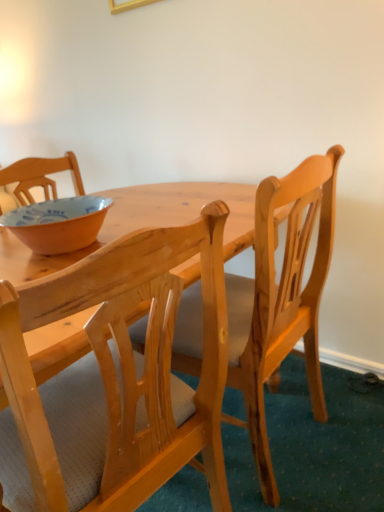
Where is `natural wood chair at center, marked as the first chair in a right-to-left arrangement`? Image resolution: width=384 pixels, height=512 pixels. natural wood chair at center, marked as the first chair in a right-to-left arrangement is located at coordinates (281, 298).

Locate an element on the screen. The image size is (384, 512). matte orange bowl at left is located at coordinates point(58,223).

Where is `natural wood chair at center, the second chair from the left`? Image resolution: width=384 pixels, height=512 pixels. natural wood chair at center, the second chair from the left is located at coordinates (281, 298).

Is natural wood chair at center, which is the second chair in right-to-left order, completely or partially outside of natural wood chair at center, the second chair from the left?

That's correct, natural wood chair at center, which is the second chair in right-to-left order, is outside of natural wood chair at center, the second chair from the left.

Which object is closer to the camera taking this photo, natural wood chair at center, which is the second chair in right-to-left order, or natural wood chair at center, marked as the first chair in a right-to-left arrangement?

natural wood chair at center, which is the second chair in right-to-left order, is closer to the camera.

From the image's perspective, which object appears higher, natural wood chair at center, the 1th chair in the left-to-right sequence, or natural wood chair at center, marked as the first chair in a right-to-left arrangement?

natural wood chair at center, marked as the first chair in a right-to-left arrangement, appears higher in the image.

In order to click on chair that is behind the natural wood chair at center, the 1th chair in the left-to-right sequence in this screenshot , I will do `click(281, 298)`.

Is natural wood chair at center, the second chair from the left, looking in the opposite direction of natural wood chair at center, which is the second chair in right-to-left order?

No, natural wood chair at center, the second chair from the left,'s orientation is not away from natural wood chair at center, which is the second chair in right-to-left order.

From a real-world perspective, is natural wood chair at center, the second chair from the left, above or below natural wood chair at center, the 1th chair in the left-to-right sequence?

From a real-world perspective, natural wood chair at center, the second chair from the left, is physically above natural wood chair at center, the 1th chair in the left-to-right sequence.

Is the surface of natural wood chair at center, the second chair from the left, in direct contact with natural wood chair at center, which is the second chair in right-to-left order?

No, natural wood chair at center, the second chair from the left, is not in contact with natural wood chair at center, which is the second chair in right-to-left order.

Who is shorter, natural wood chair at center, the second chair from the left, or natural wood chair at center, which is the second chair in right-to-left order?

natural wood chair at center, which is the second chair in right-to-left order, is shorter.

Considering the sizes of objects matte orange bowl at left and natural wood chair at center, the 1th chair in the left-to-right sequence, in the image provided, who is shorter, matte orange bowl at left or natural wood chair at center, the 1th chair in the left-to-right sequence,?

matte orange bowl at left is shorter.

Is natural wood chair at center, which is the second chair in right-to-left order, completely or partially inside matte orange bowl at left?

No, matte orange bowl at left does not contain natural wood chair at center, which is the second chair in right-to-left order.

Which object is closer to the camera taking this photo, matte orange bowl at left or natural wood chair at center, marked as the first chair in a right-to-left arrangement?

natural wood chair at center, marked as the first chair in a right-to-left arrangement, is in front.

How many degrees apart are the facing directions of matte orange bowl at left and natural wood chair at center, the second chair from the left?

The angular difference between matte orange bowl at left and natural wood chair at center, the second chair from the left, is 88.2 degrees.

Is matte orange bowl at left not inside natural wood chair at center, marked as the first chair in a right-to-left arrangement?

matte orange bowl at left is positioned outside natural wood chair at center, marked as the first chair in a right-to-left arrangement.

How many degrees apart are the facing directions of natural wood chair at center, the 1th chair in the left-to-right sequence, and matte orange bowl at left?

The angular difference between natural wood chair at center, the 1th chair in the left-to-right sequence, and matte orange bowl at left is 88.2 degrees.

From a real-world perspective, is natural wood chair at center, which is the second chair in right-to-left order, above or below matte orange bowl at left?

natural wood chair at center, which is the second chair in right-to-left order, is situated lower than matte orange bowl at left in the real world.

Who is smaller, natural wood chair at center, which is the second chair in right-to-left order, or matte orange bowl at left?

matte orange bowl at left is smaller.

From the image's perspective, is natural wood chair at center, which is the second chair in right-to-left order, above matte orange bowl at left?

Actually, natural wood chair at center, which is the second chair in right-to-left order, appears below matte orange bowl at left in the image.

Which object is further away from the camera, natural wood chair at center, the second chair from the left, or matte orange bowl at left?

matte orange bowl at left is behind.

Does natural wood chair at center, the second chair from the left, appear on the left side of matte orange bowl at left?

No.

Considering the sizes of objects natural wood chair at center, marked as the first chair in a right-to-left arrangement, and matte orange bowl at left in the image provided, who is wider, natural wood chair at center, marked as the first chair in a right-to-left arrangement, or matte orange bowl at left?

With larger width is natural wood chair at center, marked as the first chair in a right-to-left arrangement.

Is natural wood chair at center, the second chair from the left, aimed at matte orange bowl at left?

No, natural wood chair at center, the second chair from the left, is not turned towards matte orange bowl at left.

At what (x,y) coordinates should I click in order to perform the action: click on chair in front of the natural wood chair at center, the second chair from the left. Please return your answer as a coordinate pair (x, y). Looking at the image, I should click on (114, 379).

At what (x,y) coordinates should I click in order to perform the action: click on chair located on the left of natural wood chair at center, the second chair from the left. Please return your answer as a coordinate pair (x, y). Looking at the image, I should click on (114, 379).

From the image, which object appears to be nearer to natural wood chair at center, marked as the first chair in a right-to-left arrangement, natural wood chair at center, which is the second chair in right-to-left order, or matte orange bowl at left?

Based on the image, natural wood chair at center, which is the second chair in right-to-left order, appears to be nearer to natural wood chair at center, marked as the first chair in a right-to-left arrangement.

When comparing their distances from matte orange bowl at left, does natural wood chair at center, which is the second chair in right-to-left order, or natural wood chair at center, the second chair from the left, seem closer?

natural wood chair at center, which is the second chair in right-to-left order, is closer to matte orange bowl at left.

Looking at this image, considering their positions, is natural wood chair at center, the second chair from the left, positioned further to natural wood chair at center, which is the second chair in right-to-left order, than matte orange bowl at left?

Among the two, matte orange bowl at left is located further to natural wood chair at center, which is the second chair in right-to-left order.

Which object lies nearer to the anchor point matte orange bowl at left, natural wood chair at center, marked as the first chair in a right-to-left arrangement, or natural wood chair at center, which is the second chair in right-to-left order?

natural wood chair at center, which is the second chair in right-to-left order, is closer to matte orange bowl at left.

Which object lies further to the anchor point natural wood chair at center, the second chair from the left, matte orange bowl at left or natural wood chair at center, which is the second chair in right-to-left order?

matte orange bowl at left.

When comparing their distances from natural wood chair at center, the 1th chair in the left-to-right sequence, does matte orange bowl at left or natural wood chair at center, the second chair from the left, seem closer?

natural wood chair at center, the second chair from the left, lies closer to natural wood chair at center, the 1th chair in the left-to-right sequence, than the other object.

Image resolution: width=384 pixels, height=512 pixels. I want to click on chair located between natural wood chair at center, the 1th chair in the left-to-right sequence, and matte orange bowl at left in the depth direction, so click(x=281, y=298).